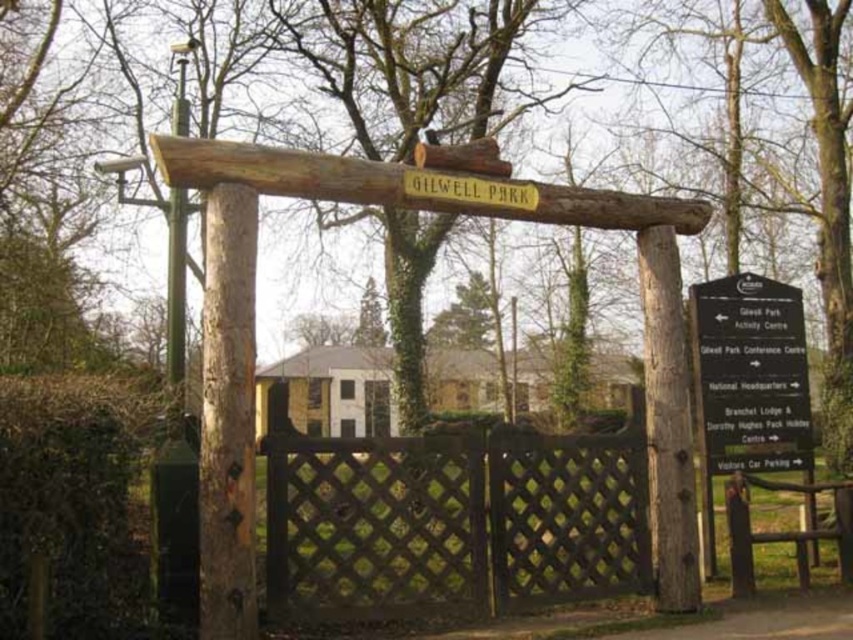
Question: Which object appears closest to the camera in this image?

Choices:
 (A) brown lattice fence at center
 (B) black wood sign at right

Answer: (A)

Question: Is brown lattice fence at center positioned in front of black wood sign at right?

Choices:
 (A) yes
 (B) no

Answer: (A)

Question: Does brown lattice fence at center have a larger size compared to black wood sign at right?

Choices:
 (A) no
 (B) yes

Answer: (B)

Question: Among these objects, which one is nearest to the camera?

Choices:
 (A) black wood sign at right
 (B) brown lattice fence at center

Answer: (B)

Question: Among these objects, which one is nearest to the camera?

Choices:
 (A) black wood sign at right
 (B) brown lattice fence at center

Answer: (B)

Question: Can you confirm if brown lattice fence at center is smaller than black wood sign at right?

Choices:
 (A) no
 (B) yes

Answer: (A)